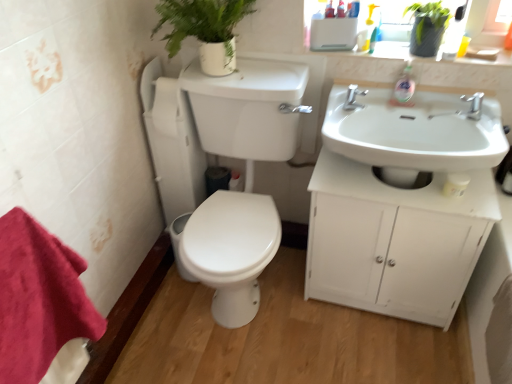
Identify the location of white glossy sink at right. This screenshot has width=512, height=384. pyautogui.click(x=415, y=130).

What do you see at coordinates (463, 46) in the screenshot?
I see `yellow plastic cup at upper right` at bounding box center [463, 46].

This screenshot has height=384, width=512. What do you see at coordinates (205, 29) in the screenshot?
I see `green matte plant at upper center, the 1th plant when ordered from left to right` at bounding box center [205, 29].

Identify the location of white glossy toilet bowl at lower center. This screenshot has width=512, height=384. (178, 244).

Image resolution: width=512 pixels, height=384 pixels. I want to click on silver metallic faucet at upper right, the second tap viewed from the left, so click(x=474, y=105).

Could you tell me if silver metallic tap at upper center, which ranks as the second tap in right-to-left order, is facing white matte cabinet at right?

No, silver metallic tap at upper center, which ranks as the second tap in right-to-left order, is not facing towards white matte cabinet at right.

Between silver metallic tap at upper center, which ranks as the first tap in left-to-right order, and white matte cabinet at right, which one has larger size?

white matte cabinet at right.

From the image's perspective, between silver metallic tap at upper center, which ranks as the second tap in right-to-left order, and white matte cabinet at right, which one is located above?

silver metallic tap at upper center, which ranks as the second tap in right-to-left order, from the image's perspective.

Which is correct: red cotton towel at lower left is inside green matte plant at upper center, the 1th plant when ordered from left to right, or outside of it?

red cotton towel at lower left exists outside the volume of green matte plant at upper center, the 1th plant when ordered from left to right.

Which is nearer, (23,280) or (203,18)?

Positioned in front is point (23,280).

Considering the sizes of objects red cotton towel at lower left and green matte plant at upper center, the 1th plant when ordered from left to right, in the image provided, who is taller, red cotton towel at lower left or green matte plant at upper center, the 1th plant when ordered from left to right,?

red cotton towel at lower left is taller.

In the scene shown: Does yellow plastic cup at upper right turn towards white matte cabinet at right?

No, yellow plastic cup at upper right does not turn towards white matte cabinet at right.

Which is in front, yellow plastic cup at upper right or white matte cabinet at right?

Positioned in front is white matte cabinet at right.

In the scene shown: From the image's perspective, does yellow plastic cup at upper right appear higher than white matte cabinet at right?

Correct, yellow plastic cup at upper right appears higher than white matte cabinet at right in the image.

Can you confirm if white matte cabinet at right is positioned to the right of green matte plant at upper center, which is the 2th plant from right to left?

Yes.

Considering the positions of point (424, 301) and point (232, 62), is point (424, 301) closer or farther from the camera than point (232, 62)?

Clearly, point (424, 301) is more distant from the camera than point (232, 62).

Can you tell me how much white matte cabinet at right and green matte plant at upper center, which is the 2th plant from right to left, differ in facing direction?

white matte cabinet at right and green matte plant at upper center, which is the 2th plant from right to left, are facing 2.23 degrees away from each other.

From the image's perspective, between white matte cabinet at right and green matte plant at upper center, the 1th plant when ordered from left to right, which one is located above?

green matte plant at upper center, the 1th plant when ordered from left to right, appears higher in the image.

From the image's perspective, is white glossy toilet bowl at lower center located beneath red cotton towel at lower left?

Actually, white glossy toilet bowl at lower center appears above red cotton towel at lower left in the image.

Find the location of a particular element. The height and width of the screenshot is (384, 512). toilet bowl lying above the red cotton towel at lower left (from the image's perspective) is located at coordinates (178, 244).

Is white glossy toilet bowl at lower center facing away from red cotton towel at lower left?

That's not correct — white glossy toilet bowl at lower center is not looking away from red cotton towel at lower left.

Considering the relative positions of white glossy toilet bowl at lower center and red cotton towel at lower left in the image provided, is white glossy toilet bowl at lower center to the left of red cotton towel at lower left from the viewer's perspective?

No, white glossy toilet bowl at lower center is not to the left of red cotton towel at lower left.

Which is in front, silver metallic tap at upper center, which ranks as the first tap in left-to-right order, or white glossy toilet at center-left?

white glossy toilet at center-left.

Which of these two, silver metallic tap at upper center, which ranks as the first tap in left-to-right order, or white glossy toilet at center-left, stands taller?

With more height is white glossy toilet at center-left.

From a real-world perspective, between silver metallic tap at upper center, which ranks as the second tap in right-to-left order, and white glossy toilet at center-left, who is vertically higher?

In real-world perspective, silver metallic tap at upper center, which ranks as the second tap in right-to-left order, is above.

From the image's perspective, between silver metallic tap at upper center, which ranks as the first tap in left-to-right order, and white glossy toilet at center-left, which one is located above?

silver metallic tap at upper center, which ranks as the first tap in left-to-right order, is shown above in the image.

Considering the relative positions of white glossy sink at right and silver metallic tap at upper center, which ranks as the second tap in right-to-left order, in the image provided, is white glossy sink at right behind silver metallic tap at upper center, which ranks as the second tap in right-to-left order,?

No, the depth of white glossy sink at right is less than that of silver metallic tap at upper center, which ranks as the second tap in right-to-left order.

The image size is (512, 384). Find the location of `tap that is the 1st object above the white glossy sink at right (from a real-world perspective)`. tap that is the 1st object above the white glossy sink at right (from a real-world perspective) is located at coordinates (353, 98).

Is white glossy sink at right oriented towards silver metallic tap at upper center, which ranks as the first tap in left-to-right order?

No, white glossy sink at right is not oriented towards silver metallic tap at upper center, which ranks as the first tap in left-to-right order.

How different are the orientations of white glossy sink at right and silver metallic tap at upper center, which ranks as the second tap in right-to-left order, in degrees?

The angle between the facing direction of white glossy sink at right and the facing direction of silver metallic tap at upper center, which ranks as the second tap in right-to-left order, is 1.87e-05 degrees.

Where is `bathroom cabinet in front of the silver metallic tap at upper center, which ranks as the second tap in right-to-left order`? bathroom cabinet in front of the silver metallic tap at upper center, which ranks as the second tap in right-to-left order is located at coordinates (394, 241).

Where is `plant that is the 1st one when counting upward from the red cotton towel at lower left (from the image's perspective)`? plant that is the 1st one when counting upward from the red cotton towel at lower left (from the image's perspective) is located at coordinates (205, 29).

Estimate the real-world distances between objects in this image. Which object is further from yellow plastic cup at upper right, white glossy sink at right or white matte cabinet at right?

white matte cabinet at right is positioned further to the anchor yellow plastic cup at upper right.

Looking at the image, which one is located further to white glossy sink at right, green matte plant at upper center, the 1th plant when ordered from left to right, or white matte cabinet at right?

Among the two, green matte plant at upper center, the 1th plant when ordered from left to right, is located further to white glossy sink at right.

Considering their positions, is silver metallic faucet at upper right, the second tap viewed from the left, positioned further to yellow plastic cup at upper right than silver metallic tap at upper center, which ranks as the first tap in left-to-right order?

silver metallic tap at upper center, which ranks as the first tap in left-to-right order.

Estimate the real-world distances between objects in this image. Which object is further from silver metallic tap at upper center, which ranks as the first tap in left-to-right order, white matte cabinet at right or yellow plastic cup at upper right?

Based on the image, white matte cabinet at right appears to be further to silver metallic tap at upper center, which ranks as the first tap in left-to-right order.

Considering their positions, is white matte cabinet at right positioned closer to green matte plant at upper center, the 1th plant when ordered from left to right, than white glossy sink at right?

Based on the image, white glossy sink at right appears to be nearer to green matte plant at upper center, the 1th plant when ordered from left to right.

Based on their spatial positions, is white glossy toilet at center-left or green matte plant at upper center, which is the 2th plant from right to left, further from white glossy sink at right?

The object further to white glossy sink at right is green matte plant at upper center, which is the 2th plant from right to left.

When comparing their distances from green matte plant at upper right, the first plant positioned from the right, does white matte cabinet at right or silver metallic faucet at upper right, acting as the 1th tap starting from the right, seem further?

Among the two, white matte cabinet at right is located further to green matte plant at upper right, the first plant positioned from the right.

Which object lies further to the anchor point red cotton towel at lower left, green matte plant at upper right, the first plant positioned from the right, or yellow plastic cup at upper right?

Based on the image, yellow plastic cup at upper right appears to be further to red cotton towel at lower left.

The height and width of the screenshot is (384, 512). I want to click on porcelain between white glossy toilet bowl at lower center and white glossy sink at right from left to right, so (x=227, y=156).

Image resolution: width=512 pixels, height=384 pixels. I want to click on porcelain located between red cotton towel at lower left and white glossy toilet bowl at lower center in the depth direction, so click(x=227, y=156).

This screenshot has width=512, height=384. Find the location of `tap between white glossy toilet at center-left and white matte cabinet at right from left to right`. tap between white glossy toilet at center-left and white matte cabinet at right from left to right is located at coordinates (353, 98).

The height and width of the screenshot is (384, 512). Find the location of `porcelain located between white glossy toilet bowl at lower center and yellow plastic cup at upper right in the left-right direction`. porcelain located between white glossy toilet bowl at lower center and yellow plastic cup at upper right in the left-right direction is located at coordinates (227, 156).